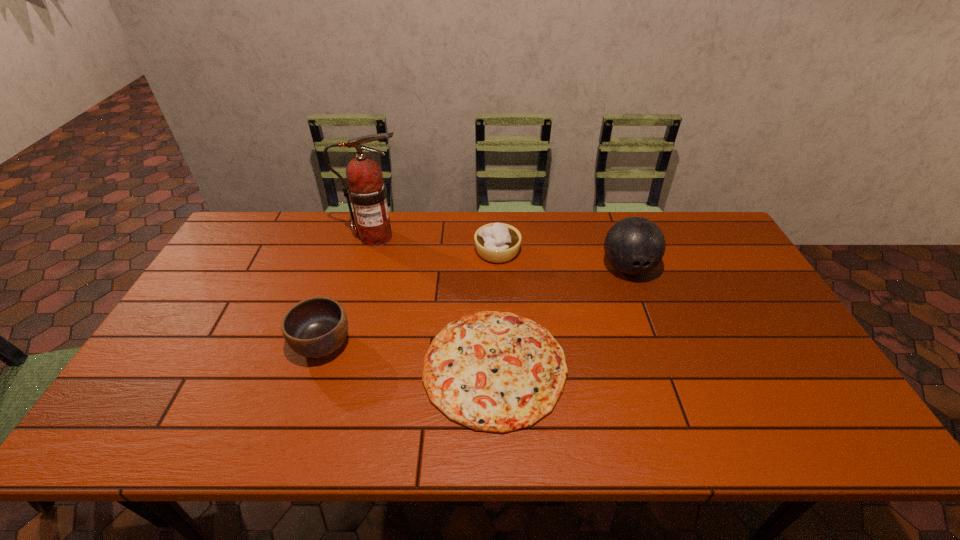
Where is `fire extinguisher`? fire extinguisher is located at coordinates (366, 190).

You are a GUI agent. You are given a task and a screenshot of the screen. Output one action in this format:
    pyautogui.click(x=<x>, y=<y>)
    Task: Click on the fourth shortest object
    
    Given the screenshot: What is the action you would take?
    (635, 245)

Locate an element on the screen. The width and height of the screenshot is (960, 540). bowling ball is located at coordinates (635, 245).

The width and height of the screenshot is (960, 540). Find the location of `whipped cream`. whipped cream is located at coordinates (496, 242).

Image resolution: width=960 pixels, height=540 pixels. In order to click on bowl in this screenshot , I will do `click(315, 327)`.

I want to click on the shortest object, so click(x=491, y=371).

The image size is (960, 540). I want to click on vacant area located at the nozzle of the fire extinguisher, so click(464, 237).

The height and width of the screenshot is (540, 960). What are the coordinates of `free space located 0.070m on the grip area of the bowling ball` in the screenshot? It's located at (641, 304).

Where is `free spot located 0.190m on the left of the whipped cream`? free spot located 0.190m on the left of the whipped cream is located at coordinates (417, 252).

I want to click on blank space located 0.210m on the right of the bowl, so click(x=432, y=345).